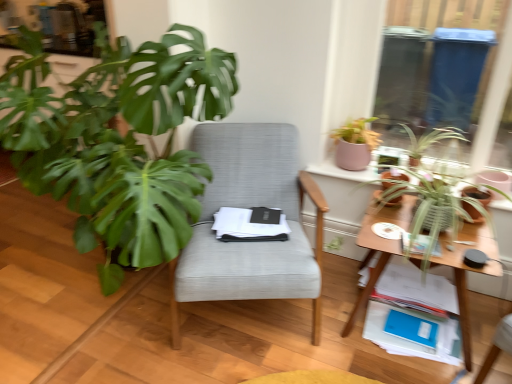
Question: From a real-world perspective, is green leafy plant at upper right, positioned as the first houseplant in right-to-left order, beneath pink matte pot at upper right, positioned as the 2th houseplant in left-to-right order?

Choices:
 (A) no
 (B) yes

Answer: (B)

Question: Does green leafy plant at upper right, positioned as the first houseplant in right-to-left order, appear on the right side of pink matte pot at upper right, positioned as the 2th houseplant in left-to-right order?

Choices:
 (A) yes
 (B) no

Answer: (A)

Question: Can you confirm if green leafy plant at upper right, which is the 5th houseplant in left-to-right order, is positioned to the left of pink matte pot at upper right, positioned as the 2th houseplant in left-to-right order?

Choices:
 (A) yes
 (B) no

Answer: (B)

Question: From the image's perspective, is green leafy plant at upper right, which is the 5th houseplant in left-to-right order, on pink matte pot at upper right, positioned as the 2th houseplant in left-to-right order?

Choices:
 (A) no
 (B) yes

Answer: (A)

Question: Does green leafy plant at upper right, which is the 5th houseplant in left-to-right order, lie in front of pink matte pot at upper right, positioned as the 2th houseplant in left-to-right order?

Choices:
 (A) yes
 (B) no

Answer: (A)

Question: Is pink matte pot at upper right, positioned as the 2th houseplant in left-to-right order, completely or partially inside green leafy plant at upper right, which is the 5th houseplant in left-to-right order?

Choices:
 (A) yes
 (B) no

Answer: (B)

Question: Does wooden table at right have a greater width compared to matte brown flowerpot at upper right, marked as the 2th flowerpot in a right-to-left arrangement?

Choices:
 (A) no
 (B) yes

Answer: (B)

Question: Could you tell me if wooden table at right is turned towards matte brown flowerpot at upper right, marked as the 2th flowerpot in a right-to-left arrangement?

Choices:
 (A) no
 (B) yes

Answer: (A)

Question: Considering the relative sizes of wooden table at right and matte brown flowerpot at upper right, positioned as the 1th flowerpot in left-to-right order, in the image provided, is wooden table at right thinner than matte brown flowerpot at upper right, positioned as the 1th flowerpot in left-to-right order,?

Choices:
 (A) yes
 (B) no

Answer: (B)

Question: From the image's perspective, is wooden table at right located beneath matte brown flowerpot at upper right, marked as the 2th flowerpot in a right-to-left arrangement?

Choices:
 (A) yes
 (B) no

Answer: (A)

Question: Is matte brown flowerpot at upper right, marked as the 2th flowerpot in a right-to-left arrangement, at the back of wooden table at right?

Choices:
 (A) yes
 (B) no

Answer: (B)

Question: Is wooden table at right further to camera compared to matte brown flowerpot at upper right, positioned as the 1th flowerpot in left-to-right order?

Choices:
 (A) yes
 (B) no

Answer: (B)

Question: From a real-world perspective, does pink matte pot at upper right, the fourth houseplant viewed from the right, stand above textured gray chair at center?

Choices:
 (A) yes
 (B) no

Answer: (A)